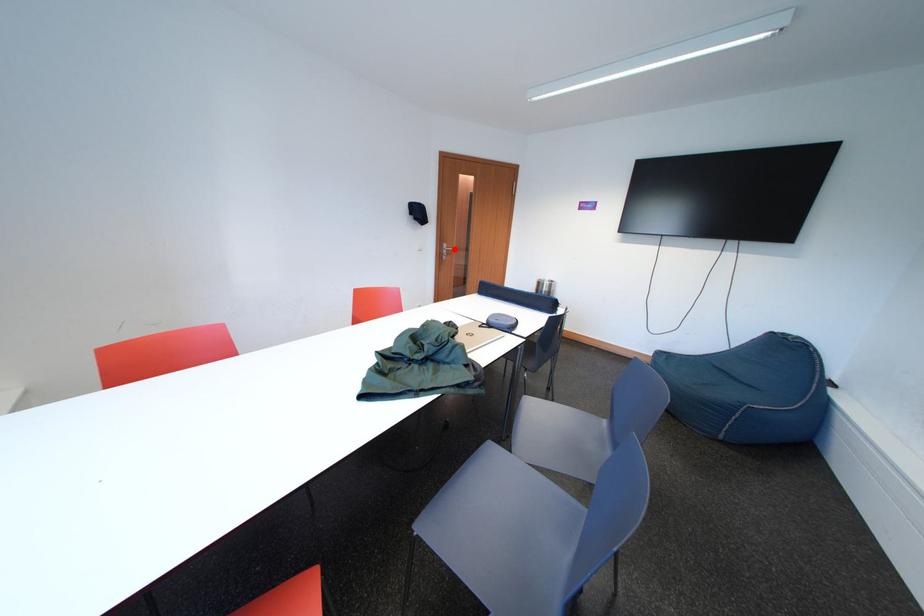
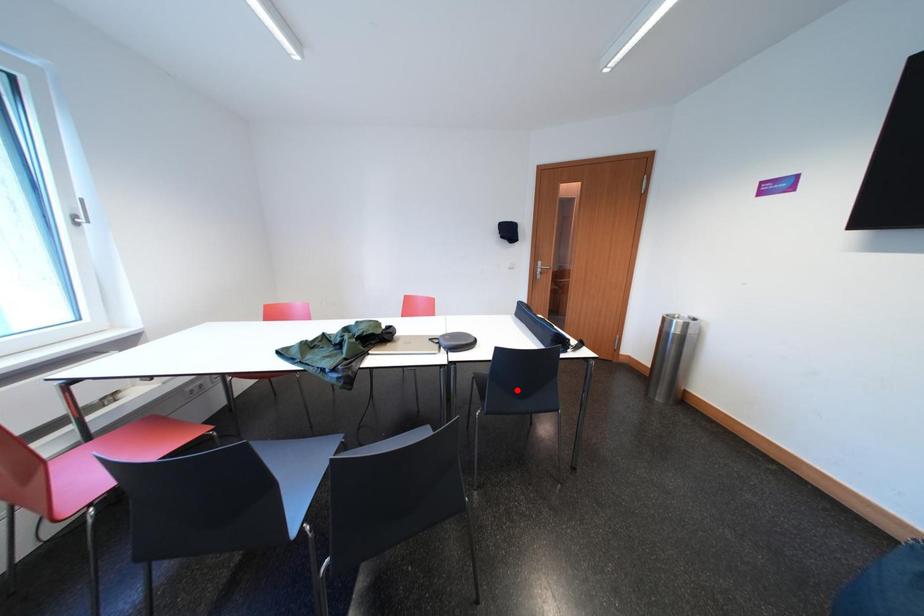
I am providing you with two images of the same scene from different viewpoints. A red point is marked on the first image and another point is marked on the second image. Do the highlighted points in image1 and image2 indicate the same real-world spot?

No